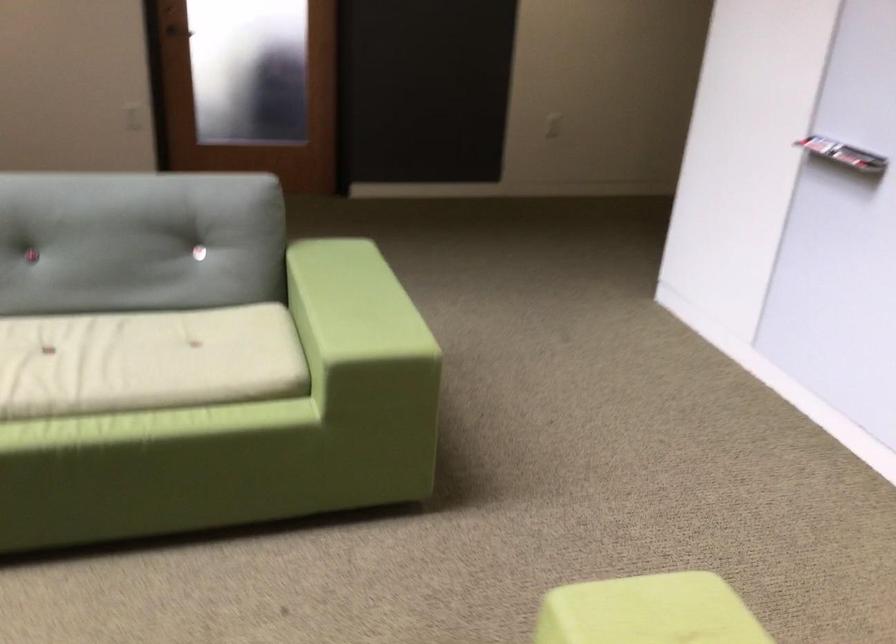
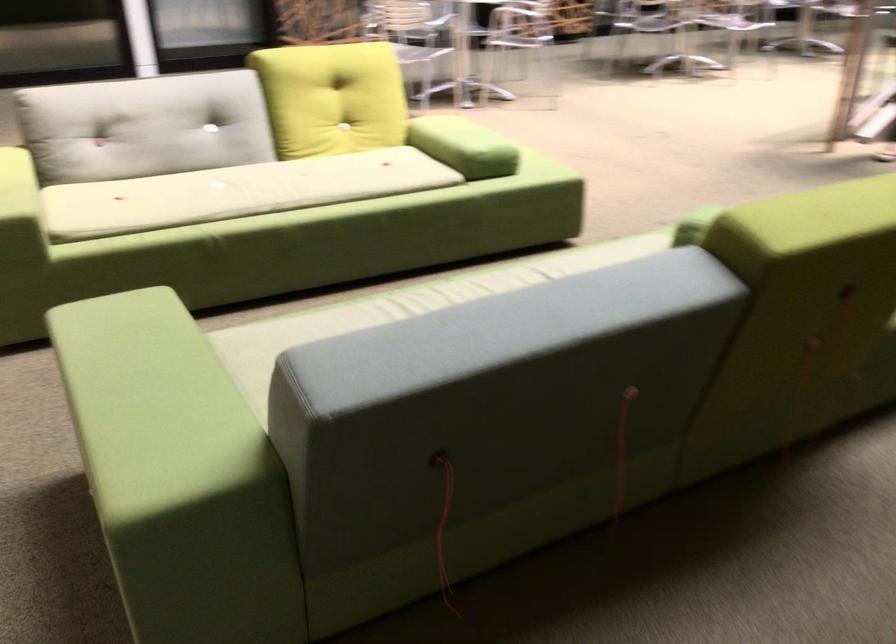
The point at (339, 263) is marked in the first image. Where is the corresponding point in the second image?

(151, 404)